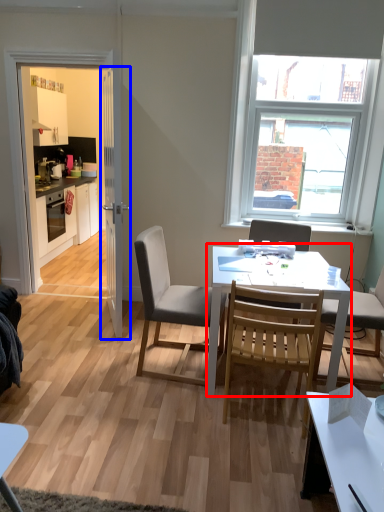
Question: Which object appears farthest to the camera in this image, round table (highlighted by a red box) or door (highlighted by a blue box)?

Choices:
 (A) round table
 (B) door

Answer: (B)